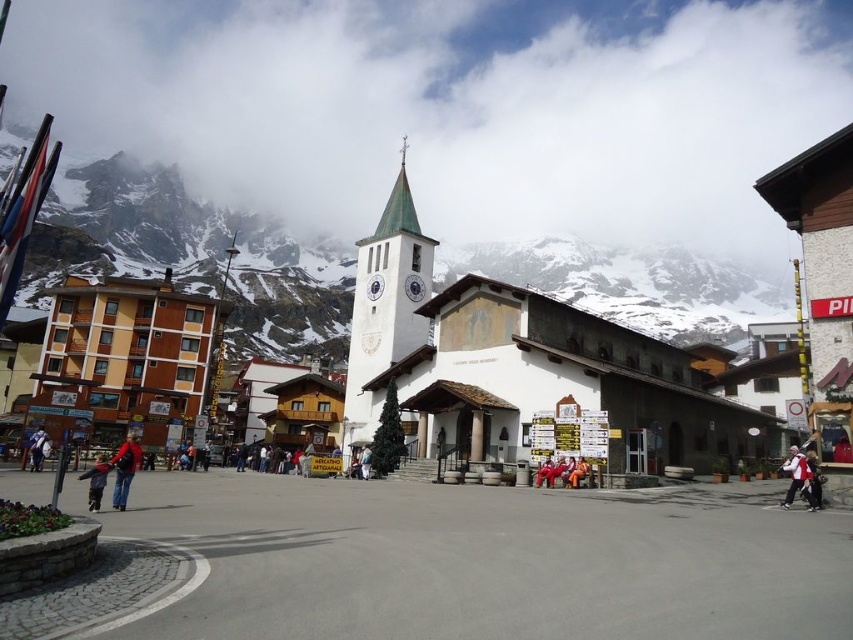
You are standing in the alpine town square and want to take a photo of the yellow wood building at left and the white cotton jacket at lower right. Which object should you focus on first if you want both to be in clear focus?

You should focus on the yellow wood building at left first because it is closer to you than the white cotton jacket at lower right, so adjusting focus from near to far will help both be in clear focus.

You are standing in the alpine town square and see the white cotton jacket at lower right. If you want to reach it without moving closer than 30 meters, can you still touch it?

The white cotton jacket at lower right is 38.76 meters away from the camera. Since you want to stay at least 30 meters away, you cannot touch it without moving closer than your desired distance.

You are standing in the alpine town square and want to take a photo of the two points marked in the image. Which point, point [790,470] or point [36,444], appears larger in your camera view?

Point [790,470] appears larger in your camera view because it is closer to the viewer than point [36,444].